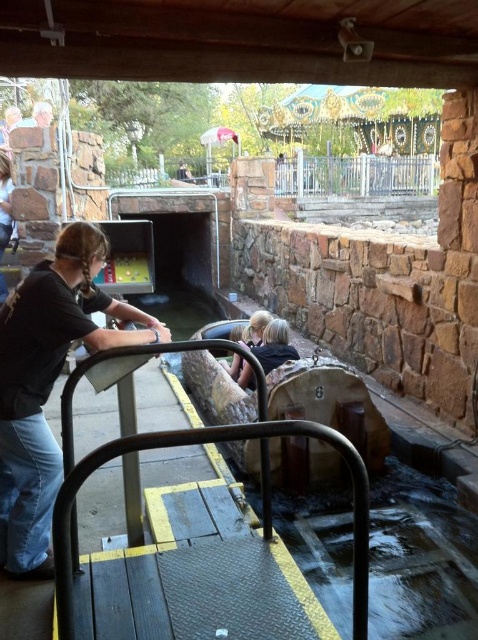
Question: Does black matte shirt at left lie behind matte black shirt at upper left?

Choices:
 (A) yes
 (B) no

Answer: (B)

Question: Is black matte shirt at left positioned behind matte black shirt at upper left?

Choices:
 (A) no
 (B) yes

Answer: (A)

Question: Is black matte shirt at left further to camera compared to matte black shirt at upper left?

Choices:
 (A) yes
 (B) no

Answer: (B)